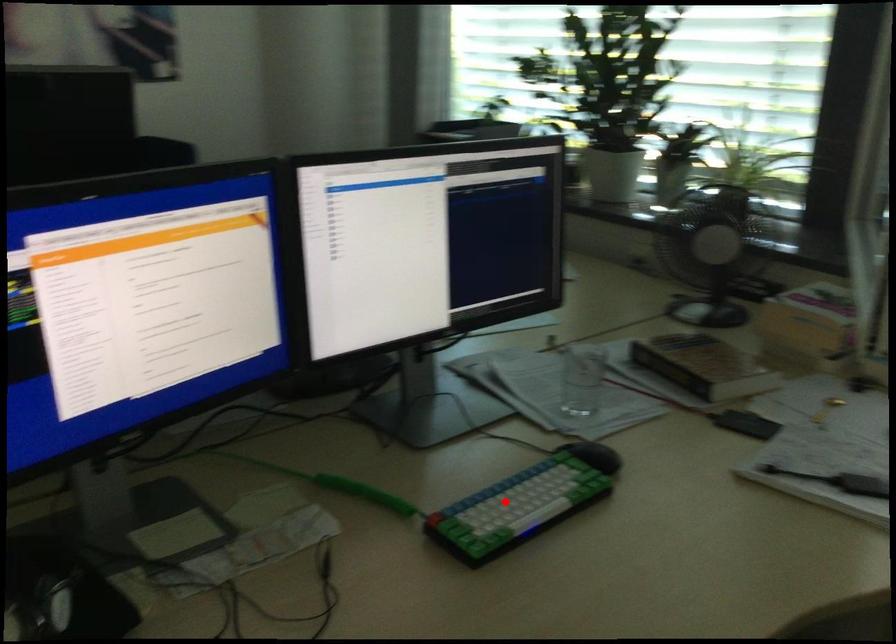
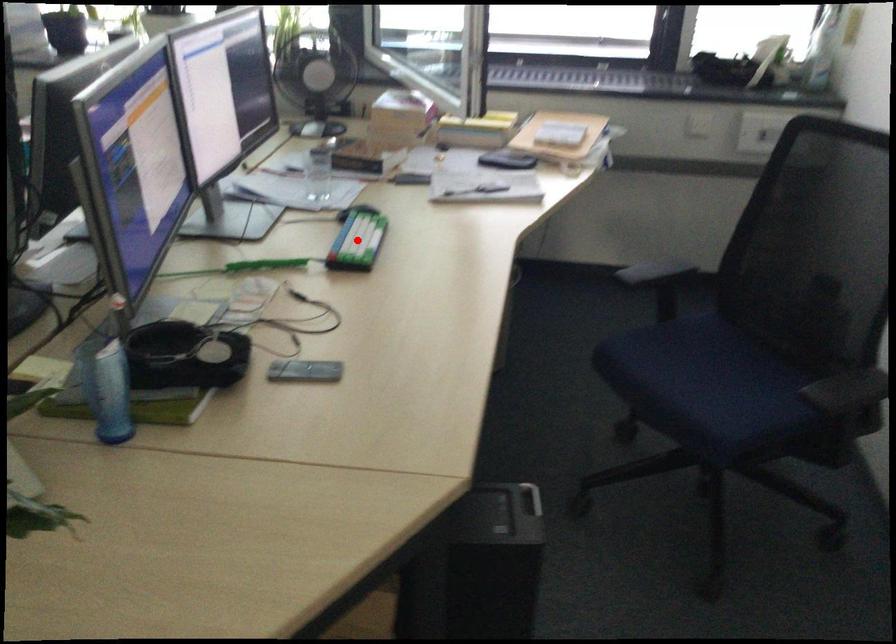
I am providing you with two images of the same scene from different viewpoints. A red point is marked on the first image and another point is marked on the second image. Is the red point in image1 aligned with the point shown in image2?

Yes